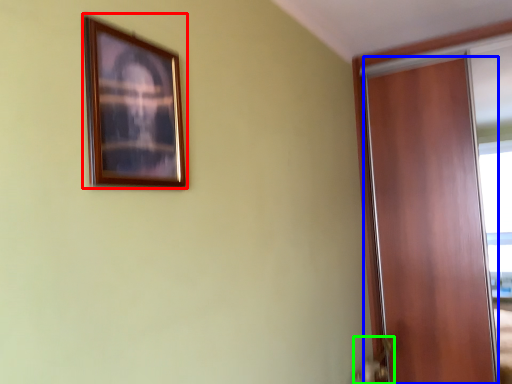
Question: Which object is the closest to the picture frame (highlighted by a red box)? Choose among these: door (highlighted by a blue box) or door handle (highlighted by a green box).

Choices:
 (A) door
 (B) door handle

Answer: (B)